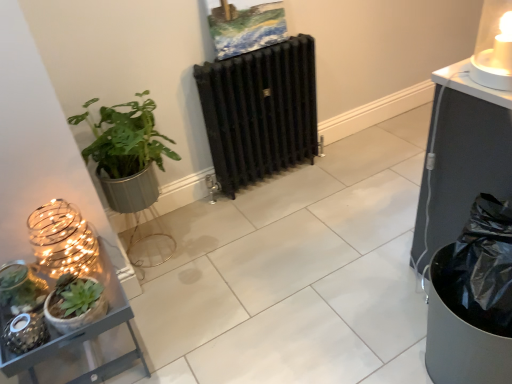
Question: Is black cast iron radiator at center situated inside translucent glass candle at upper right, the second candle holder when ordered from left to right, or outside?

Choices:
 (A) inside
 (B) outside

Answer: (B)

Question: Is black cast iron radiator at center in front of or behind translucent glass candle at upper right, the second candle holder when ordered from left to right, in the image?

Choices:
 (A) front
 (B) behind

Answer: (B)

Question: Estimate the real-world distances between objects in this image. Which object is farther from the green matte plant at left, the 1th houseplant when ordered from back to front?

Choices:
 (A) metallic gray shelf at lower left
 (B) green matte succulent at lower left
 (C) matte gold wire candle holder at left, the 2th candle holder positioned from the right
 (D) translucent glass candle at upper right, marked as the 2th candle holder in a bottom-to-top arrangement
 (E) green matte succulent at lower left, which is the 2th houseplant in back-to-front order

Answer: (D)

Question: Which object is the farthest from the translucent glass candle at upper right, which is the first candle holder in right-to-left order?

Choices:
 (A) black cast iron radiator at center
 (B) green matte succulent at lower left
 (C) metallic gray shelf at lower left
 (D) matte gold wire candle holder at left, the first candle holder ordered from the bottom
 (E) green matte plant at left, the 1th houseplant when ordered from back to front

Answer: (B)